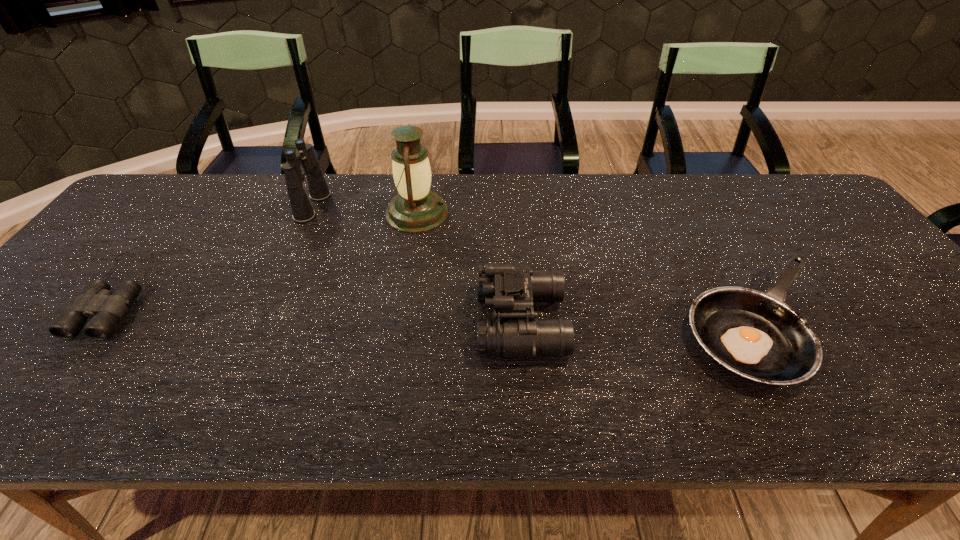
I want to click on vacant space at the far edge, so click(x=544, y=212).

In the image, there is a desktop. Where is `vacant space at the near edge`? The image size is (960, 540). vacant space at the near edge is located at coordinates (191, 408).

Locate an element on the screen. The width and height of the screenshot is (960, 540). vacant space at the left edge of the desktop is located at coordinates (127, 233).

Image resolution: width=960 pixels, height=540 pixels. I want to click on vacant space at the right edge, so click(837, 249).

The image size is (960, 540). In the image, there is a desktop. Find the location of `vacant space at the far left corner`. vacant space at the far left corner is located at coordinates (175, 202).

The width and height of the screenshot is (960, 540). I want to click on vacant space at the far right corner, so click(x=756, y=180).

This screenshot has height=540, width=960. In the image, there is a desktop. What are the coordinates of `free space at the near right corner` in the screenshot? It's located at (941, 399).

Locate an element on the screen. This screenshot has width=960, height=540. blank region between the rightmost binoculars and the second tallest object is located at coordinates (417, 264).

At what (x,y) coordinates should I click in order to perform the action: click on vacant area that lies between the shortest binoculars and the second binoculars from right to left. Please return your answer as a coordinate pair (x, y). Looking at the image, I should click on (216, 249).

At what (x,y) coordinates should I click in order to perform the action: click on blank region between the lantern and the leftmost object. Please return your answer as a coordinate pair (x, y). Looking at the image, I should click on (269, 253).